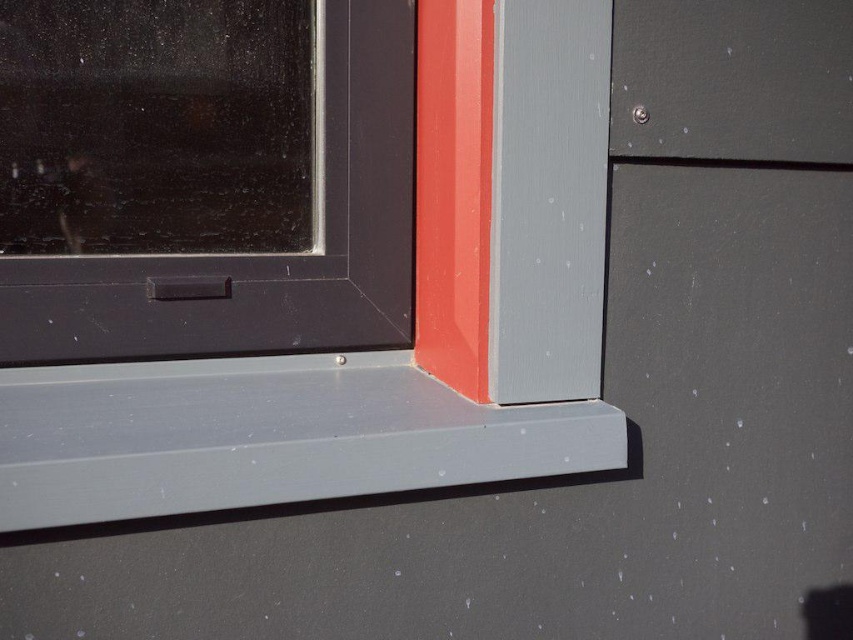
You are standing in front of the window corner shown in the image. You need to reach a point located at coordinates point (68, 486). If your hand can extend 30 inches forward, will you be able to touch that point?

The distance of point (68, 486) from camera is 33.82 inches. Since your hand can only extend 30 inches, you cannot reach the point.

You are a painter trying to touch up the window corner. The matte gray plastic at lower center needs repainting. Where exactly should you focus your attention based on the coordinates provided?

The matte gray plastic at lower center is located at point (265, 435), so you should focus on that coordinate for repainting.

You are standing at the camera position and want to reach the point at coordinates point (479, 426). If your arm is 24 inches long, can you reach it without moving your feet?

The point (479, 426) is 39.24 inches away from the camera. Since your arm is only 24 inches long, you cannot reach it without moving your feet.